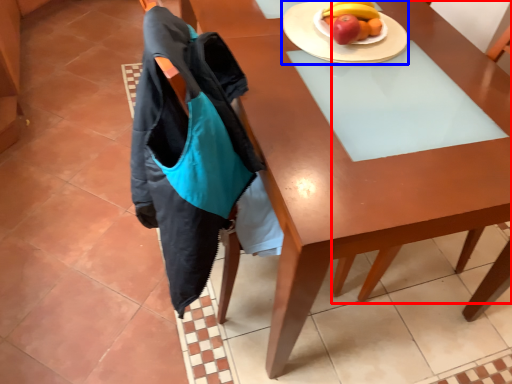
Question: Which point is closer to the camera, chair (highlighted by a red box) or plate (highlighted by a blue box)?

Choices:
 (A) chair
 (B) plate

Answer: (A)